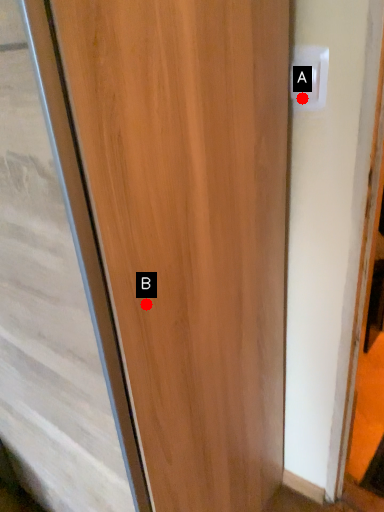
Question: Two points are circled on the image, labeled by A and B beside each circle. Which point appears closest to the camera in this image?

Choices:
 (A) A is closer
 (B) B is closer

Answer: (B)